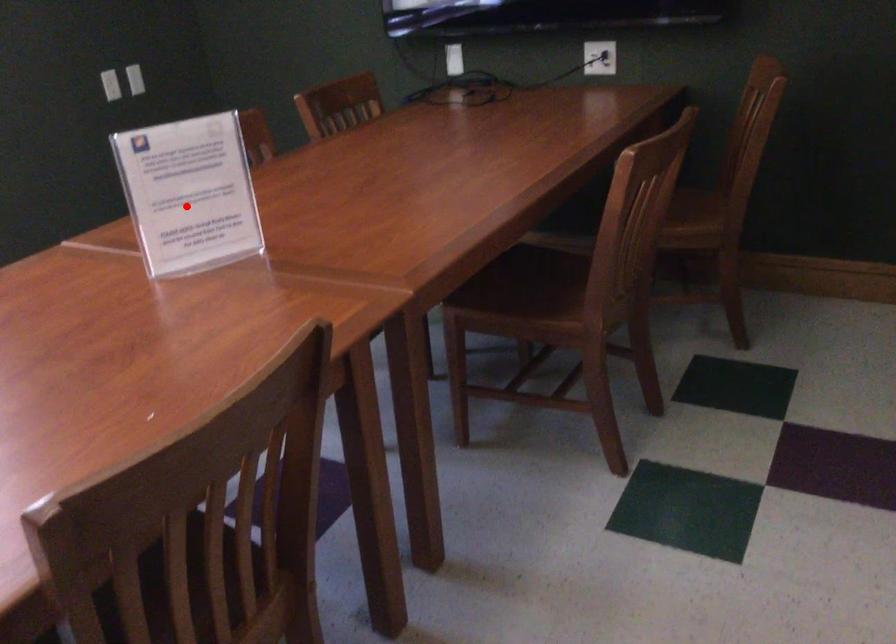
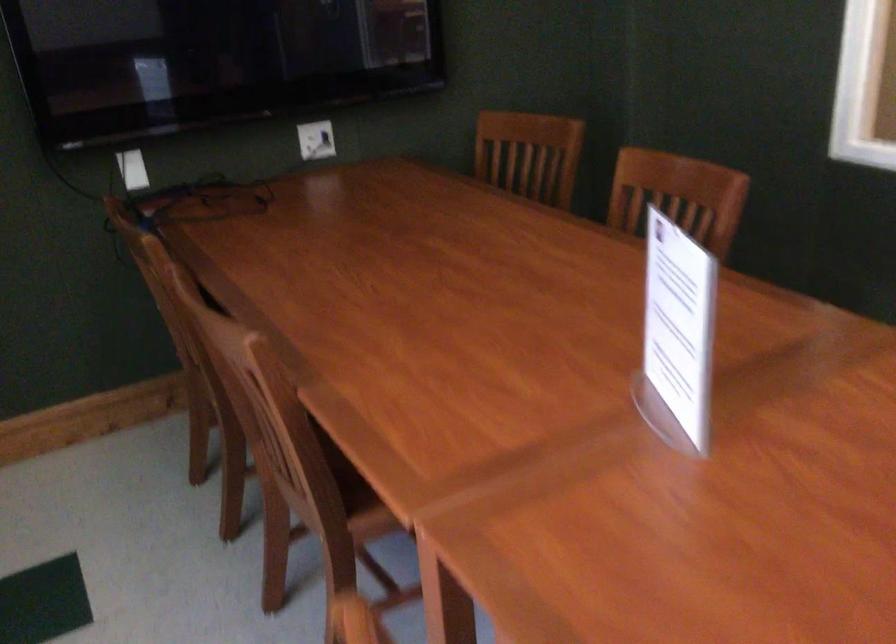
Locate, in the second image, the point that corresponds to the highlighted location in the first image.

(677, 335)